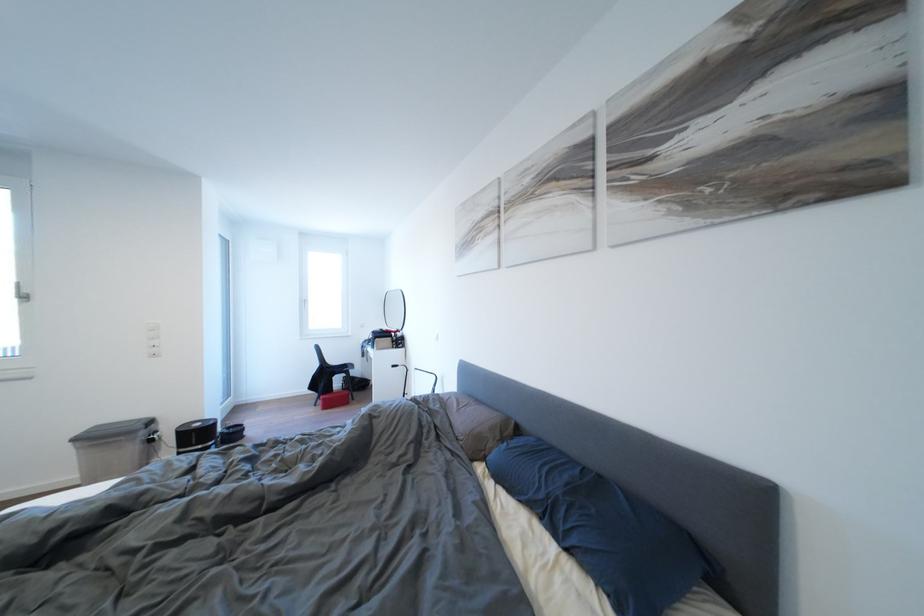
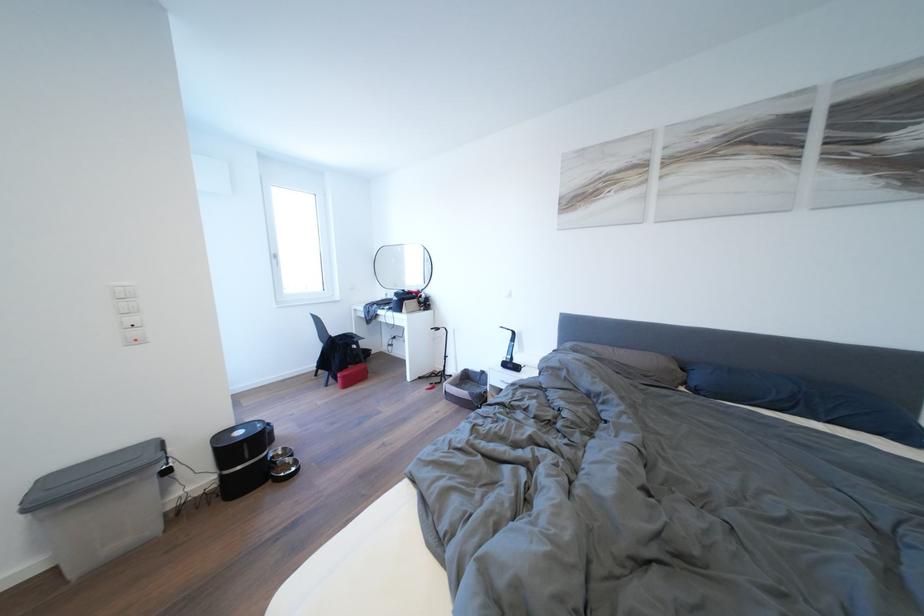
Where in the second image is the point corresponding to pixel 205 430 from the first image?

(248, 438)